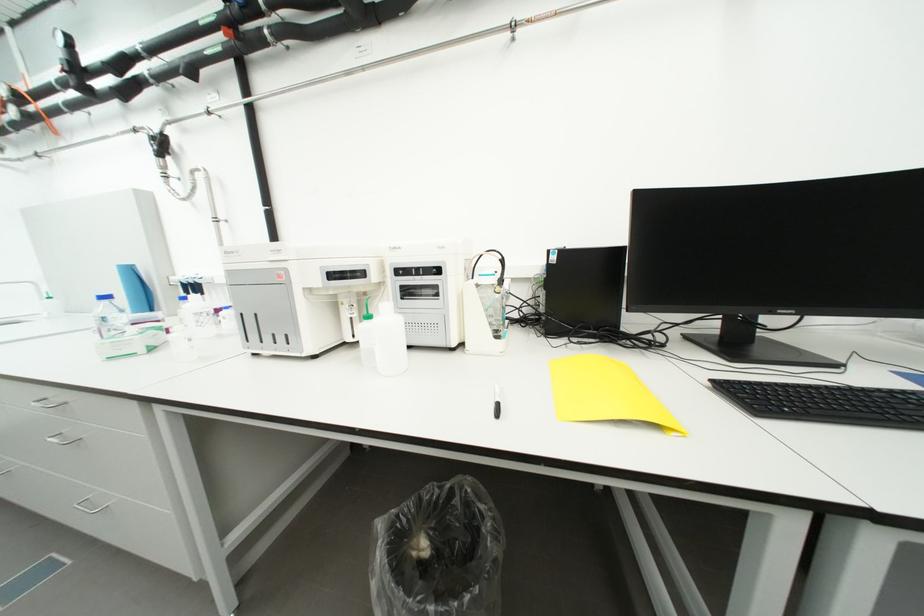
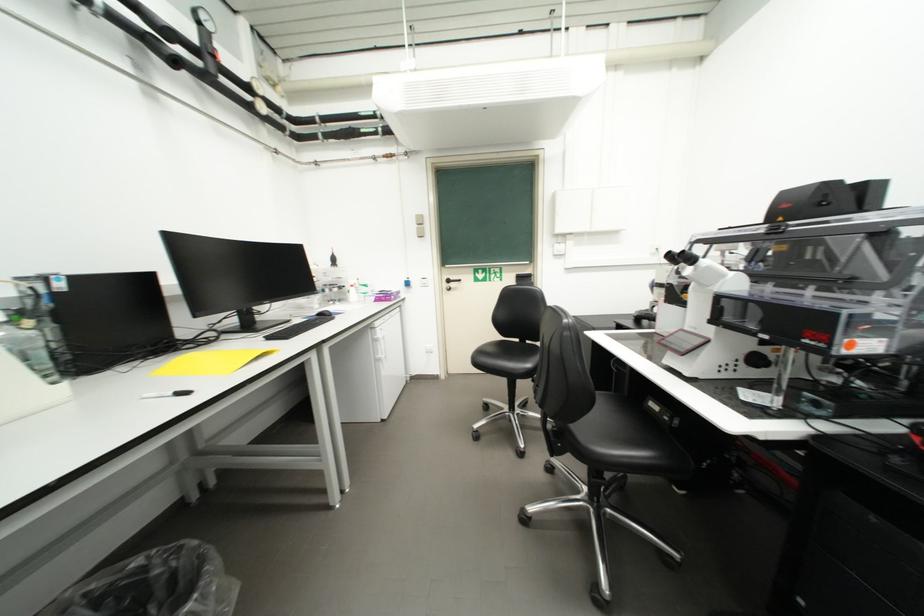
Question: Based on the continuous images, in which direction is the camera rotating? Reply with the corresponding letter.

Choices:
 (A) Left
 (B) Right
 (C) Up
 (D) Down

Answer: (B)